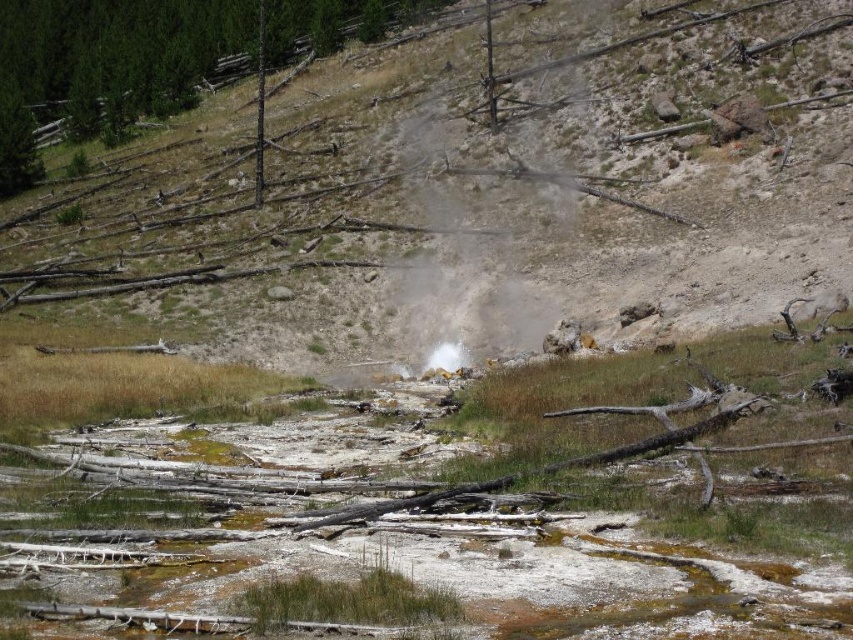
Question: Is yellowish rock at center smaller than green matte tree at upper left?

Choices:
 (A) no
 (B) yes

Answer: (A)

Question: Considering the relative positions of yellowish rock at center and green matte tree at upper left in the image provided, where is yellowish rock at center located with respect to green matte tree at upper left?

Choices:
 (A) above
 (B) below

Answer: (B)

Question: Among these points, which one is farthest from the camera?

Choices:
 (A) (27, 61)
 (B) (483, 170)

Answer: (A)

Question: Which of the following is the farthest from the observer?

Choices:
 (A) yellowish rock at center
 (B) green matte tree at upper left

Answer: (B)

Question: In this image, where is yellowish rock at center located relative to green matte tree at upper left?

Choices:
 (A) right
 (B) left

Answer: (A)